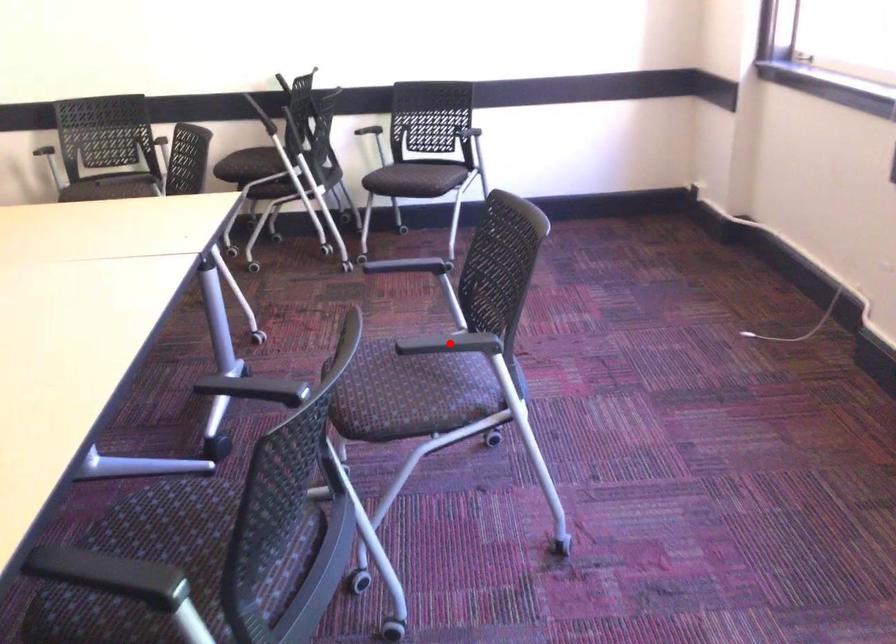
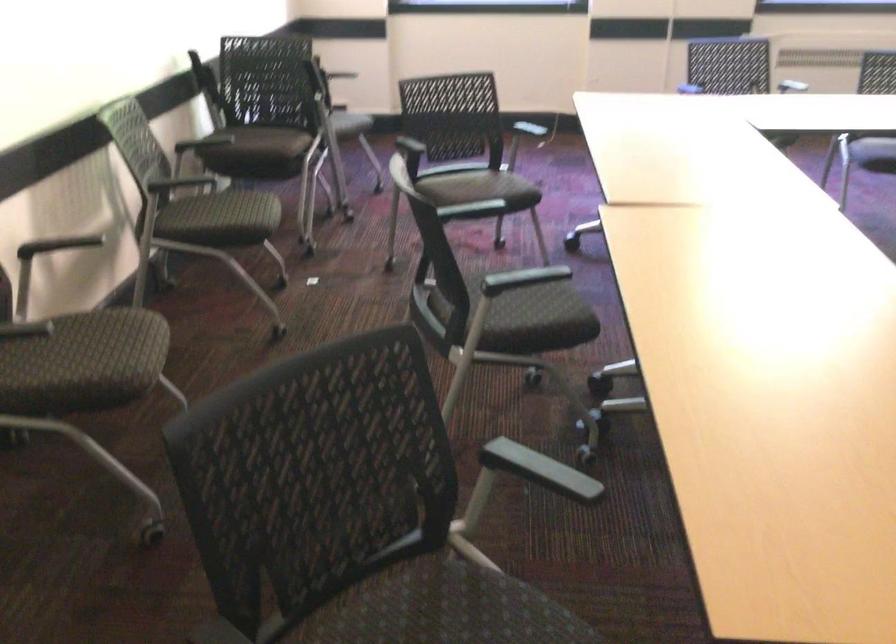
Question: I am providing you with two images of the same scene from different viewpoints. A red point is marked on the first image. At the location where the point appears in image 1, is it still visible in image 2?

Choices:
 (A) Yes
 (B) No

Answer: (B)